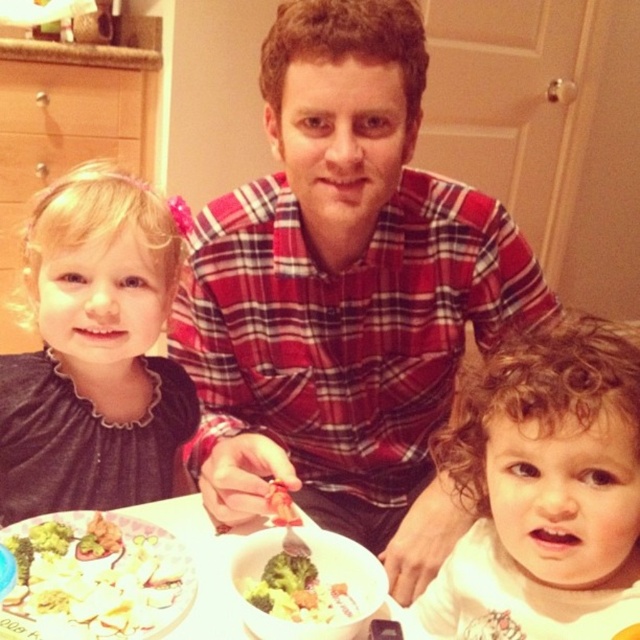
Question: Can you confirm if curly brown hair at center is positioned to the right of green broccoli at lower center?

Choices:
 (A) no
 (B) yes

Answer: (B)

Question: Is dark gray fabric dress at left above white glossy bowl at center?

Choices:
 (A) yes
 (B) no

Answer: (A)

Question: Can you confirm if curly brown hair at center is positioned below green broccoli at lower center?

Choices:
 (A) no
 (B) yes

Answer: (A)

Question: Which point is closer to the camera?

Choices:
 (A) (401, 397)
 (B) (260, 582)
 (C) (88, 202)

Answer: (B)

Question: Which point is farther to the camera?

Choices:
 (A) dark gray fabric dress at left
 (B) green broccoli at lower center
 (C) curly brown hair at center
 (D) red plaid shirt at center

Answer: (A)

Question: Which point is closer to the camera taking this photo?

Choices:
 (A) (209, 614)
 (B) (300, 609)
 (C) (513, 369)
 (D) (220, 240)

Answer: (C)